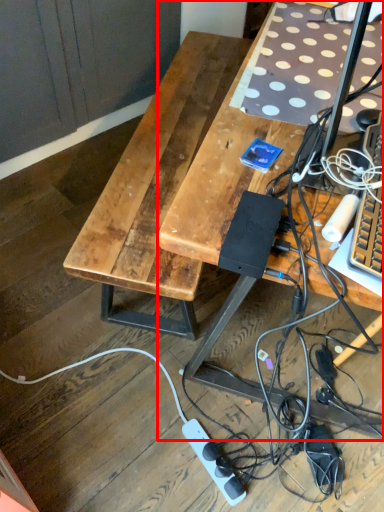
Question: From the image, what is the correct spatial relationship of desk (annotated by the red box) in relation to power outlet?

Choices:
 (A) left
 (B) right

Answer: (B)